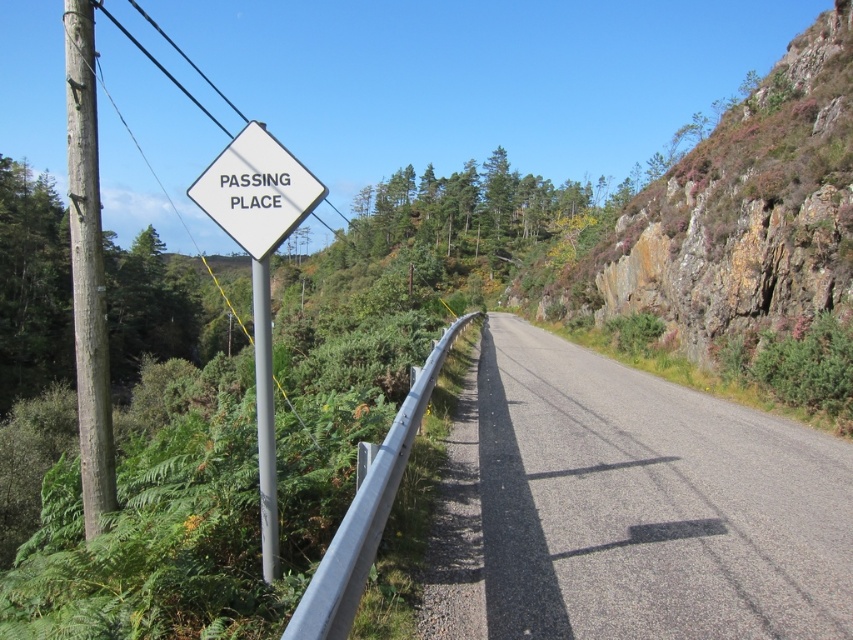
Is smooth wooden pole at left positioned behind silver metallic rail at center?

Yes, smooth wooden pole at left is behind silver metallic rail at center.

Can you confirm if smooth wooden pole at left is shorter than silver metallic rail at center?

No.

Who is more forward, (80, 81) or (347, 563)?

Point (347, 563) is in front.

Locate an element on the screen. The height and width of the screenshot is (640, 853). smooth wooden pole at left is located at coordinates (86, 268).

Which is below, silver metallic rail at center or silver metallic pole at left?

Positioned lower is silver metallic rail at center.

Can you confirm if silver metallic rail at center is smaller than silver metallic pole at left?

Correct, silver metallic rail at center occupies less space than silver metallic pole at left.

Is point (351, 538) closer to viewer compared to point (276, 513)?

Yes, point (351, 538) is in front of point (276, 513).

Identify the location of silver metallic rail at center. This screenshot has height=640, width=853. (367, 513).

Does smooth wooden pole at left have a greater height compared to silver metallic pole at left?

Indeed, smooth wooden pole at left has a greater height compared to silver metallic pole at left.

Does smooth wooden pole at left have a greater width compared to silver metallic pole at left?

Correct, the width of smooth wooden pole at left exceeds that of silver metallic pole at left.

Is point (74, 209) farther from viewer compared to point (264, 531)?

Yes, point (74, 209) is farther from viewer.

The width and height of the screenshot is (853, 640). Find the location of `smooth wooden pole at left`. smooth wooden pole at left is located at coordinates (86, 268).